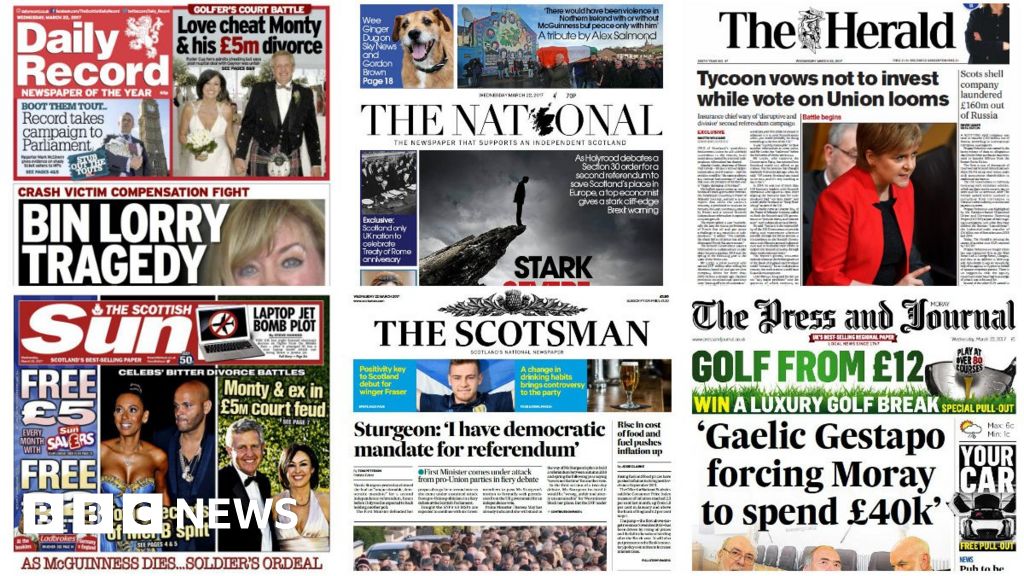
Locate an element on the screen. The width and height of the screenshot is (1024, 576). laptop is located at coordinates (234, 341).